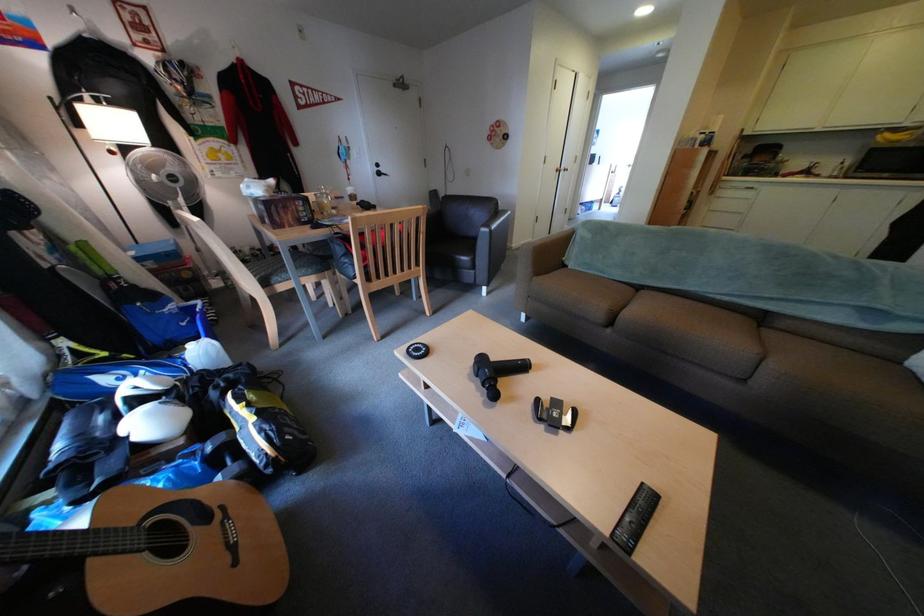
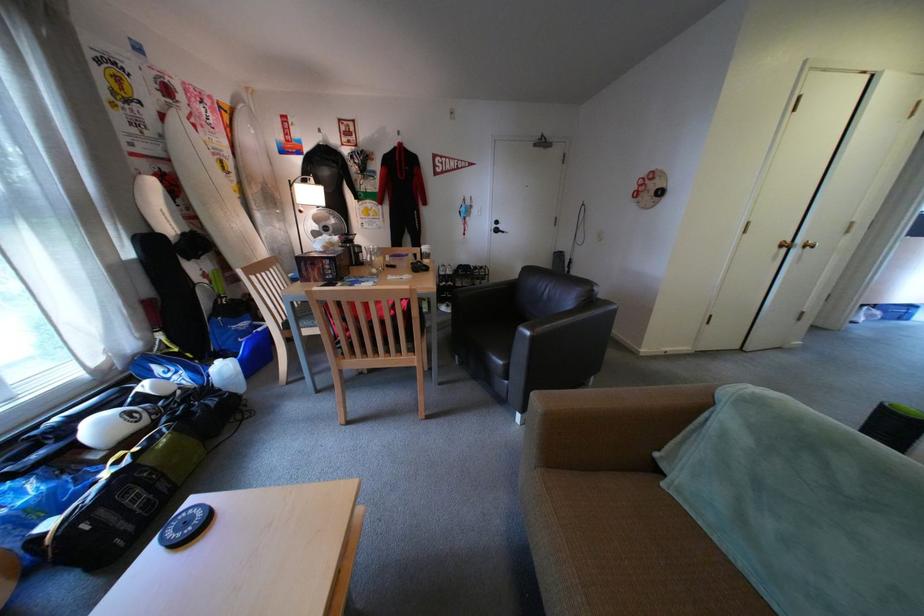
Find the pixel in the second image that matches point (204, 347) in the first image.

(233, 363)